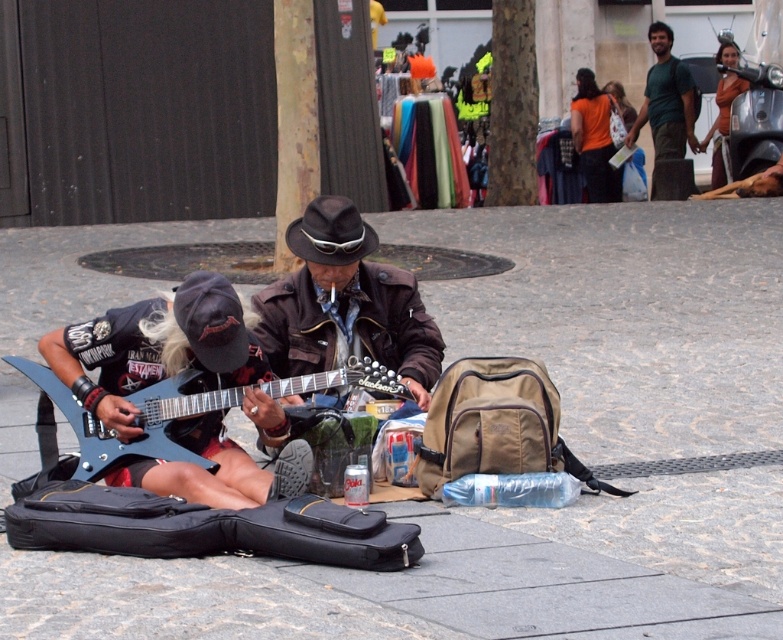
Question: Is green fabric shirt at upper right below brown felt hat at center?

Choices:
 (A) yes
 (B) no

Answer: (B)

Question: Which is farther from the gray stone pavement at center?

Choices:
 (A) brown leather jacket at center
 (B) brown felt hat at center

Answer: (B)

Question: Which object appears farthest from the camera in this image?

Choices:
 (A) metallic blue guitar at center
 (B) orange t-shirt at upper right
 (C) brown felt hat at center
 (D) brown leather jacket at center

Answer: (B)

Question: Is brown leather jacket at center wider than green fabric shirt at upper right?

Choices:
 (A) yes
 (B) no

Answer: (A)

Question: In this image, where is gray stone pavement at center located relative to brown felt hat at center?

Choices:
 (A) left
 (B) right

Answer: (B)

Question: Which point appears farthest from the camera in this image?

Choices:
 (A) (735, 56)
 (B) (496, 536)
 (C) (327, 230)

Answer: (A)